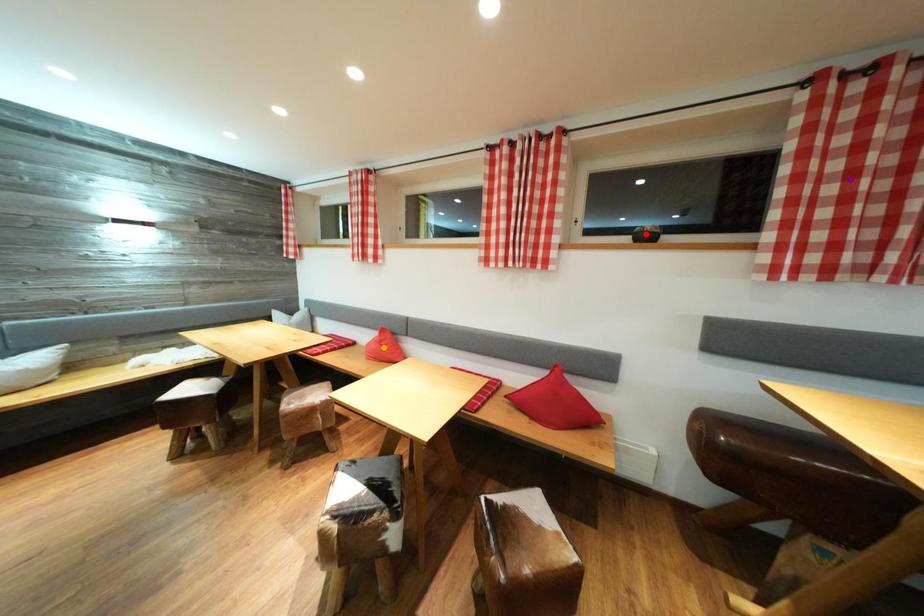
Order these from nearest to farthest:
purple point | red point | orange point

purple point < red point < orange point